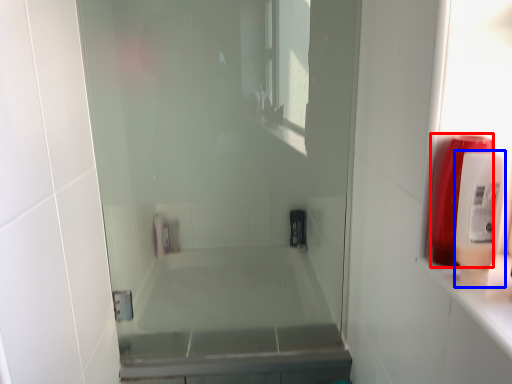
Question: Which object is closer to the camera taking this photo, soap dispenser (highlighted by a red box) or soap dispenser (highlighted by a blue box)?

Choices:
 (A) soap dispenser
 (B) soap dispenser

Answer: (B)